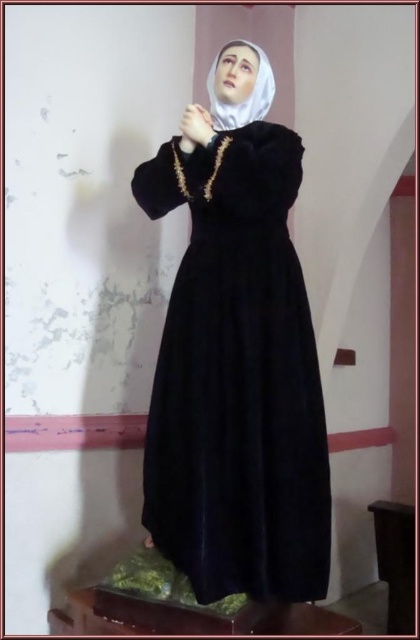
What do you see at coordinates (246, 97) in the screenshot?
I see `white matte veil at center` at bounding box center [246, 97].

Which is in front, point (262, 100) or point (207, 115)?

Point (207, 115) is in front.

The width and height of the screenshot is (420, 640). Find the location of `white matte veil at center`. white matte veil at center is located at coordinates (246, 97).

Can you confirm if velvet black dress at center is bigger than matte black hand at center?

Yes, velvet black dress at center is bigger than matte black hand at center.

Can you confirm if velvet black dress at center is smaller than matte black hand at center?

No.

Image resolution: width=420 pixels, height=640 pixels. What are the coordinates of `velvet black dress at center` in the screenshot? It's located at (236, 378).

Between velvet black dress at center and white matte veil at center, which one has less height?

With less height is white matte veil at center.

Which is more to the left, velvet black dress at center or white matte veil at center?

Positioned to the left is velvet black dress at center.

Where is `velvet black dress at center`? This screenshot has width=420, height=640. velvet black dress at center is located at coordinates (236, 378).